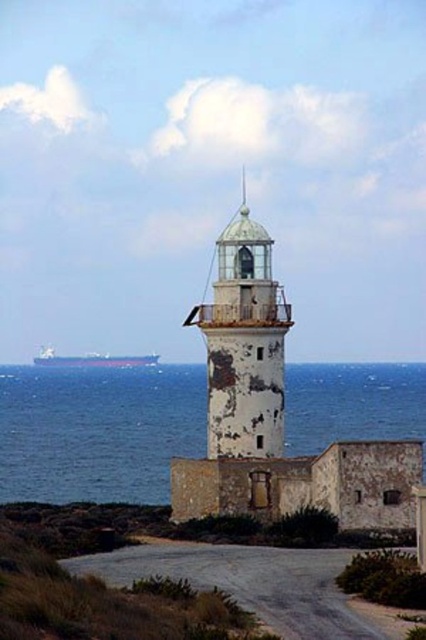
Between blue water at center and smooth gray ship at left, which one is positioned higher?

smooth gray ship at left

Can you confirm if blue water at center is positioned to the right of smooth gray ship at left?

Yes, blue water at center is to the right of smooth gray ship at left.

The image size is (426, 640). I want to click on blue water at center, so click(x=97, y=429).

Where is `blue water at center`? The image size is (426, 640). blue water at center is located at coordinates (97, 429).

Is blue water at center thinner than white weathered tower at center?

No.

Who is more forward, (186, 454) or (242, 298)?

Point (242, 298)

The image size is (426, 640). I want to click on blue water at center, so click(97, 429).

Who is more distant from viewer, (224,276) or (54,356)?

The point (54,356) is behind.

Between white weathered tower at center and smooth gray ship at left, which one is positioned higher?

white weathered tower at center is above.

Is point (273, 349) positioned before point (95, 364)?

That is True.

Identify the location of white weathered tower at center. (244, 342).